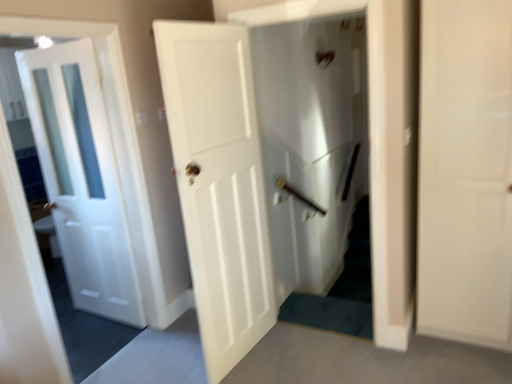
Question: Is white matte door at center, which is the second door in left-to-right order, in front of white glossy door at left, the second door from the right?

Choices:
 (A) no
 (B) yes

Answer: (B)

Question: From a real-world perspective, is white matte door at center, which is the second door in left-to-right order, over white glossy door at left, the second door from the right?

Choices:
 (A) yes
 (B) no

Answer: (B)

Question: Can you confirm if white matte door at center, which is the second door in left-to-right order, is bigger than white glossy door at left, the second door from the right?

Choices:
 (A) yes
 (B) no

Answer: (A)

Question: Can you confirm if white matte door at center, which is the second door in left-to-right order, is wider than white glossy door at left, the second door from the right?

Choices:
 (A) no
 (B) yes

Answer: (A)

Question: Is white matte door at center, which is the second door in left-to-right order, at the right side of white glossy door at left, marked as the 1th door in a left-to-right arrangement?

Choices:
 (A) no
 (B) yes

Answer: (B)

Question: Considering the relative positions of white matte door at center, which is the first door from right to left, and white glossy door at left, the second door from the right, in the image provided, is white matte door at center, which is the first door from right to left, to the left of white glossy door at left, the second door from the right, from the viewer's perspective?

Choices:
 (A) yes
 (B) no

Answer: (B)

Question: Can you confirm if white glossy door at left, the second door from the right, is shorter than white matte door at center, which is the first door from right to left?

Choices:
 (A) no
 (B) yes

Answer: (B)

Question: Can you confirm if white glossy door at left, the second door from the right, is bigger than white matte door at center, which is the first door from right to left?

Choices:
 (A) no
 (B) yes

Answer: (A)

Question: From a real-world perspective, is white glossy door at left, the second door from the right, located higher than white matte door at center, which is the second door in left-to-right order?

Choices:
 (A) yes
 (B) no

Answer: (A)

Question: Is white glossy door at left, the second door from the right, outside white matte door at center, which is the first door from right to left?

Choices:
 (A) yes
 (B) no

Answer: (A)

Question: Is white glossy door at left, marked as the 1th door in a left-to-right arrangement, turned away from white matte door at center, which is the first door from right to left?

Choices:
 (A) yes
 (B) no

Answer: (B)

Question: Could you tell me if white glossy door at left, the second door from the right, is turned towards white matte door at center, which is the second door in left-to-right order?

Choices:
 (A) no
 (B) yes

Answer: (A)

Question: Is white matte door at center, which is the first door from right to left, oriented towards white glossy door at center?

Choices:
 (A) no
 (B) yes

Answer: (B)